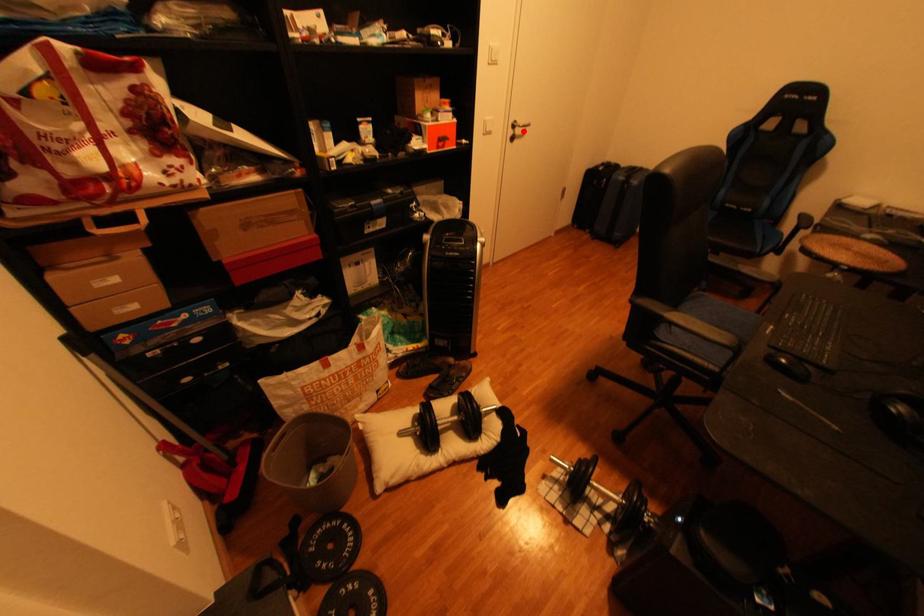
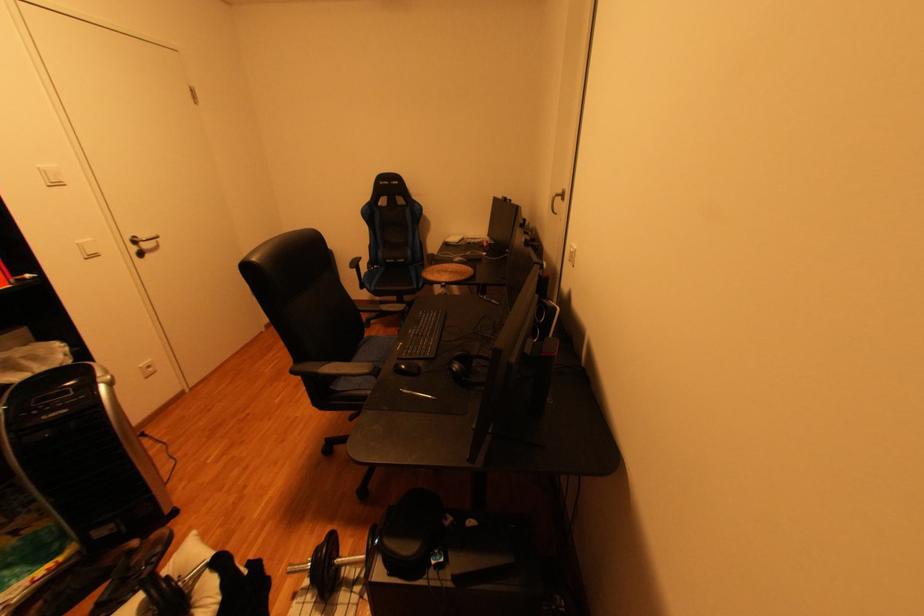
In the second image, find the point that corresponds to the highlighted location in the first image.

(150, 248)